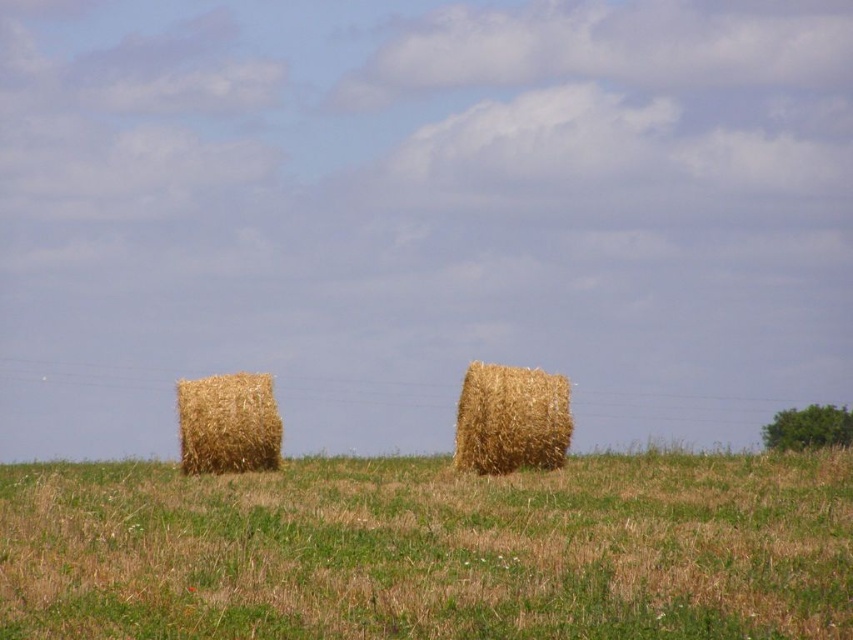
Question: Observing the image, what is the correct spatial positioning of brown straw bales at center in reference to golden straw bale at left?

Choices:
 (A) right
 (B) left

Answer: (A)

Question: Which of these objects is positioned closest to the golden straw bale at center?

Choices:
 (A) brown straw bales at center
 (B) golden straw bale at left

Answer: (B)

Question: Which object is the farthest from the brown straw bales at center?

Choices:
 (A) golden straw bale at left
 (B) golden straw bale at center

Answer: (B)

Question: Which of the following is the farthest from the observer?

Choices:
 (A) (514, 461)
 (B) (213, 419)

Answer: (B)

Question: Does brown straw bales at center come in front of golden straw bale at center?

Choices:
 (A) no
 (B) yes

Answer: (B)

Question: Does golden straw bale at center appear on the left side of golden straw bale at left?

Choices:
 (A) no
 (B) yes

Answer: (A)